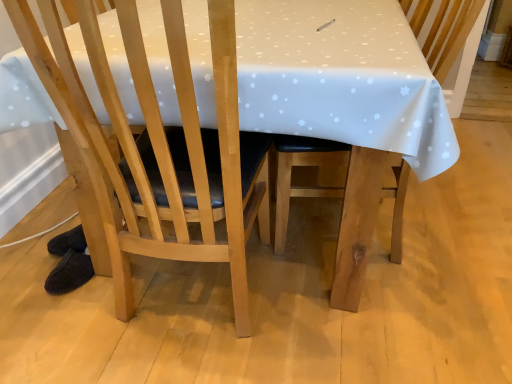
You are a GUI agent. You are given a task and a screenshot of the screen. Output one action in this format:
    pyautogui.click(x=<x>, y=<y>)
    Task: Click on the vacant space to the right of light wood chair at center, marked as the 1th chair in a left-to-right arrangement
    This screenshot has height=384, width=512.
    Given the screenshot: What is the action you would take?
    pyautogui.click(x=337, y=321)